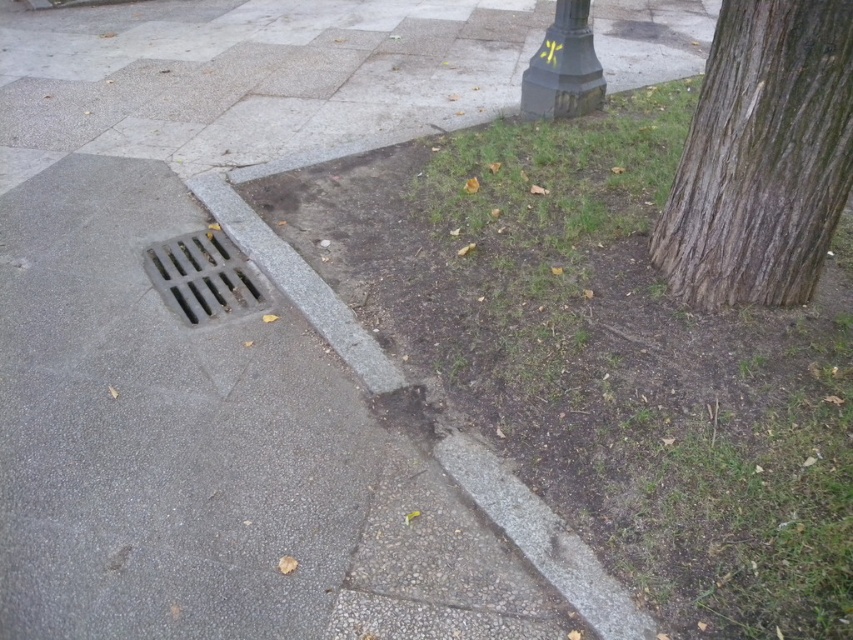
Identify the location of metallic grate at lower left. The image size is (853, 640). (202, 276).

Who is higher up, brown rough bark at right or dark green textured pole at upper right?

Positioned higher is dark green textured pole at upper right.

How distant is brown rough bark at right from dark green textured pole at upper right?

brown rough bark at right and dark green textured pole at upper right are 2.06 meters apart from each other.

Is point (753, 140) positioned behind point (581, 51)?

That is False.

Image resolution: width=853 pixels, height=640 pixels. I want to click on brown rough bark at right, so click(x=762, y=157).

Which is behind, point (846, 106) or point (171, 260)?

Positioned behind is point (171, 260).

Who is lower down, brown rough bark at right or metallic grate at lower left?

Positioned lower is metallic grate at lower left.

Is point (809, 150) more distant than point (224, 273)?

No, it is not.

Image resolution: width=853 pixels, height=640 pixels. In order to click on brown rough bark at right in this screenshot , I will do `click(762, 157)`.